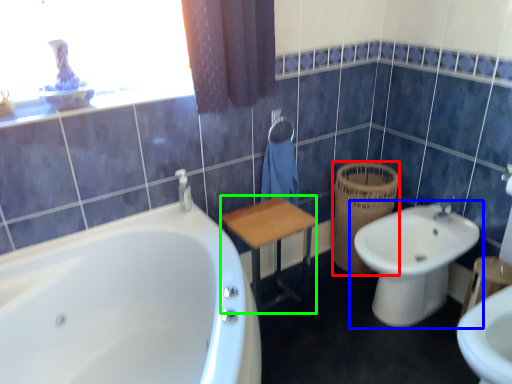
Question: Estimate the real-world distances between objects in this image. Which object is farther from basket (highlighted by a red box), toilet (highlighted by a blue box) or vanity (highlighted by a green box)?

Choices:
 (A) toilet
 (B) vanity

Answer: (B)